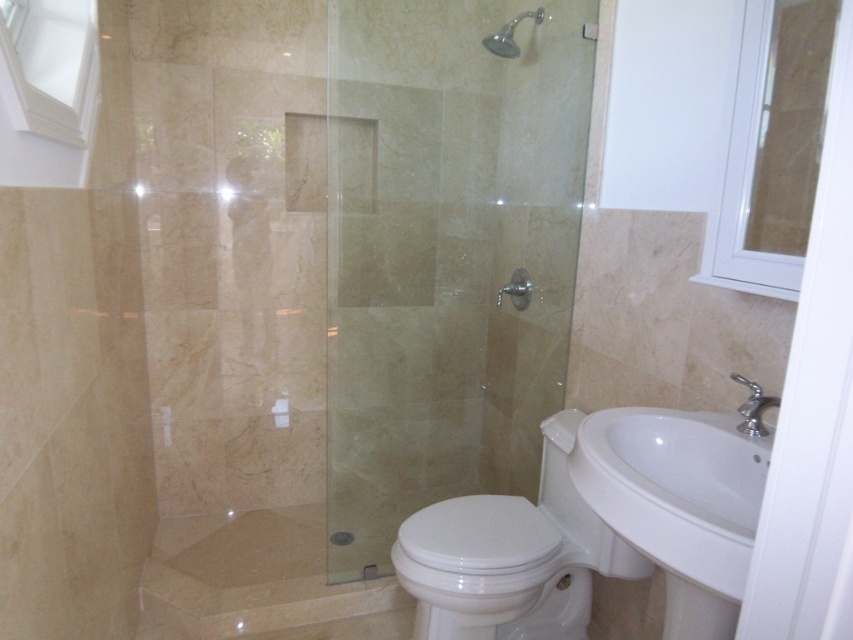
Question: Is the position of white glossy sink at lower right less distant than that of white glossy toilet at lower center?

Choices:
 (A) yes
 (B) no

Answer: (A)

Question: From the image, what is the correct spatial relationship of white glossy sink at lower right in relation to matte silver showerhead at upper center?

Choices:
 (A) above
 (B) below

Answer: (B)

Question: Which is farther from the white glossy screen door at right?

Choices:
 (A) beige marble shower at lower left
 (B) clear glass shower door at center
 (C) matte silver showerhead at upper center
 (D) white glossy sink at lower right

Answer: (C)

Question: Is white glossy screen door at right positioned in front of white glossy toilet at lower center?

Choices:
 (A) yes
 (B) no

Answer: (A)

Question: Which of the following is the closest to the observer?

Choices:
 (A) click(x=343, y=156)
 (B) click(x=796, y=502)
 (C) click(x=183, y=554)

Answer: (B)

Question: Among these objects, which one is nearest to the camera?

Choices:
 (A) white glossy sink at lower right
 (B) clear glass shower door at center
 (C) white glossy screen door at right
 (D) white glossy toilet at lower center

Answer: (C)